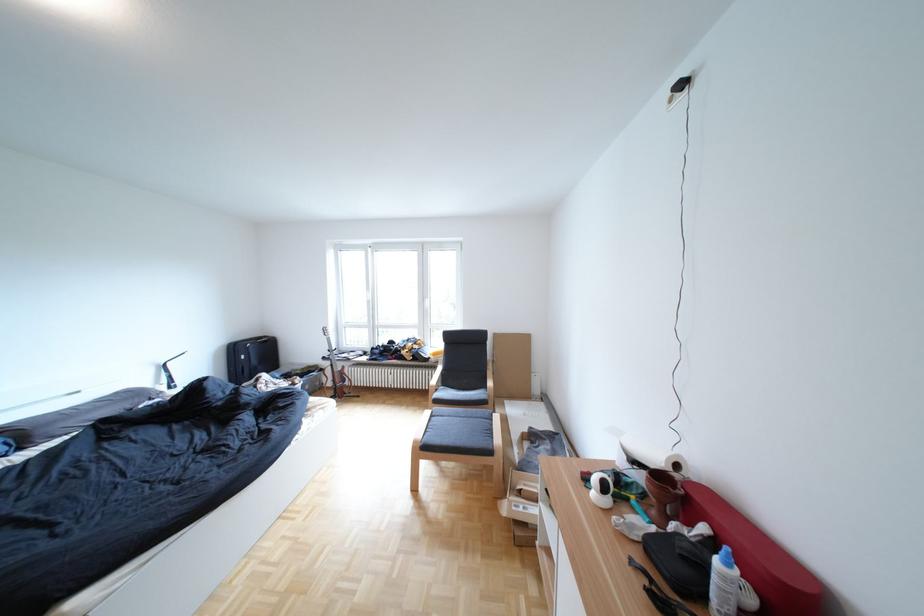
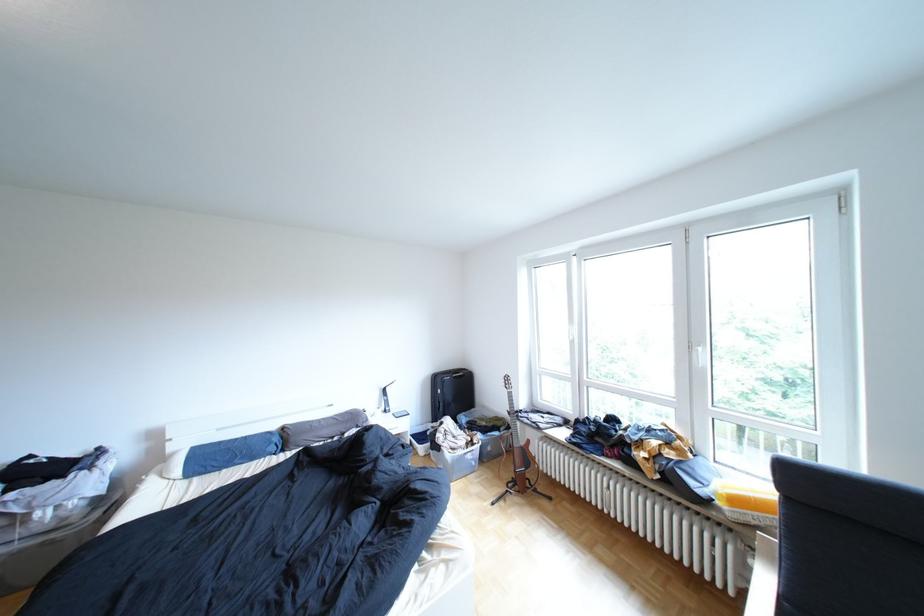
Where in the second image is the point corresponding to (x=351, y=376) from the first image?

(532, 453)